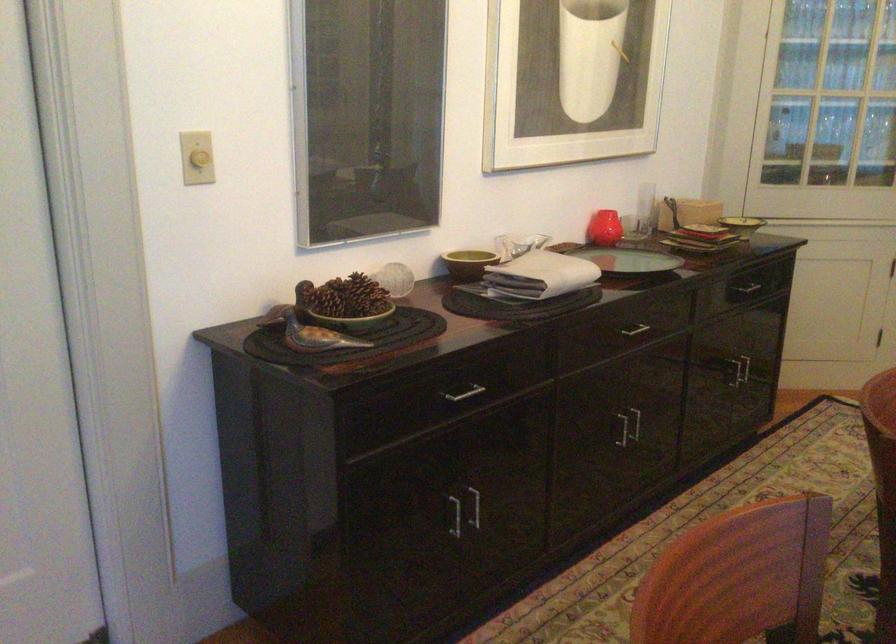
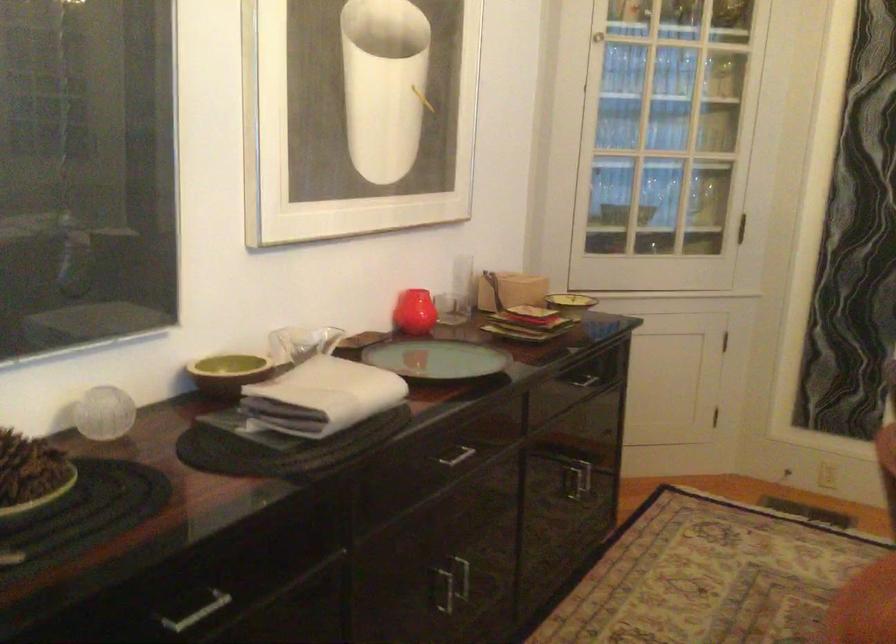
The point at [453,393] is marked in the first image. Where is the corresponding point in the second image?

(194, 609)